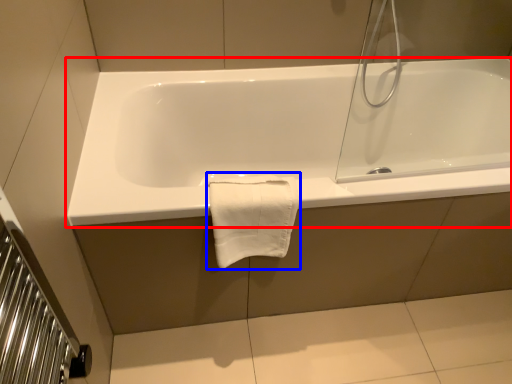
Question: Which object is closer to the camera taking this photo, bathtub (highlighted by a red box) or bath towel (highlighted by a blue box)?

Choices:
 (A) bathtub
 (B) bath towel

Answer: (B)